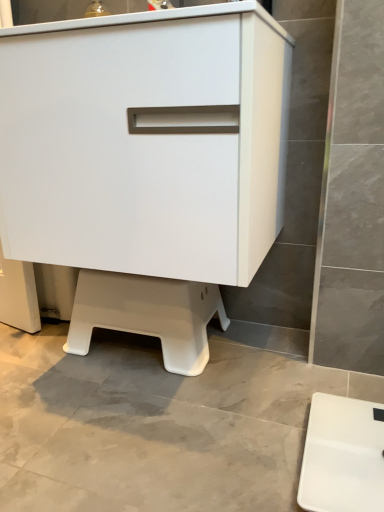
What do you see at coordinates (146, 163) in the screenshot? I see `white matte cabinet at center` at bounding box center [146, 163].

This screenshot has width=384, height=512. Describe the element at coordinates (342, 456) in the screenshot. I see `white plastic scale at lower right` at that location.

Locate an element on the screen. white matte cabinet at center is located at coordinates (146, 163).

Is white plastic step stool at lower center positioned beyond the bounds of white plastic scale at lower right?

white plastic step stool at lower center is positioned outside white plastic scale at lower right.

Which is nearer, (187, 339) or (349, 418)?

The point (349, 418) is in front.

Considering the sizes of objects white plastic step stool at lower center and white plastic scale at lower right in the image provided, who is smaller, white plastic step stool at lower center or white plastic scale at lower right?

white plastic scale at lower right.

Considering the positions of objects white plastic step stool at lower center and white plastic scale at lower right in the image provided, who is more to the right, white plastic step stool at lower center or white plastic scale at lower right?

white plastic scale at lower right.

From a real-world perspective, is white plastic scale at lower right physically above white plastic step stool at lower center?

Incorrect, from a real-world perspective, white plastic scale at lower right is lower than white plastic step stool at lower center.

Which of these two, white plastic scale at lower right or white plastic step stool at lower center, stands shorter?

Standing shorter between the two is white plastic scale at lower right.

Is white plastic scale at lower right wider than white plastic step stool at lower center?

Yes.

Find the location of a particular element. The image size is (384, 512). chest of drawers located on the right of white plastic step stool at lower center is located at coordinates (146, 163).

From the image's perspective, would you say white matte cabinet at center is positioned over white plastic step stool at lower center?

Indeed, from the image's perspective, white matte cabinet at center is shown above white plastic step stool at lower center.

Considering the positions of point (114, 247) and point (86, 345), is point (114, 247) closer or farther from the camera than point (86, 345)?

Point (114, 247) appears to be closer to the viewer than point (86, 345).

Is white matte cabinet at center aimed at white plastic step stool at lower center?

No, white matte cabinet at center is not oriented towards white plastic step stool at lower center.

Can you confirm if white matte cabinet at center is shorter than white plastic scale at lower right?

No, white matte cabinet at center is not shorter than white plastic scale at lower right.

From a real-world perspective, is white matte cabinet at center physically above white plastic scale at lower right?

Correct, in the physical world, white matte cabinet at center is higher than white plastic scale at lower right.

Is white matte cabinet at center far away from white plastic scale at lower right?

No, white matte cabinet at center is in close proximity to white plastic scale at lower right.

In terms of width, does white plastic step stool at lower center look wider or thinner when compared to white matte cabinet at center?

Considering their sizes, white plastic step stool at lower center looks slimmer than white matte cabinet at center.

From the picture: Is the depth of white plastic step stool at lower center less than that of white matte cabinet at center?

No.

Considering the sizes of objects white plastic step stool at lower center and white matte cabinet at center in the image provided, who is bigger, white plastic step stool at lower center or white matte cabinet at center?

white matte cabinet at center.

Does white plastic scale at lower right have a greater width compared to white matte cabinet at center?

In fact, white plastic scale at lower right might be narrower than white matte cabinet at center.

Locate an element on the screen. the chest of drawers above the white plastic scale at lower right (from the image's perspective) is located at coordinates (146, 163).

Which of these two, white plastic scale at lower right or white matte cabinet at center, is smaller?

white plastic scale at lower right.

In the scene shown: From their relative heights in the image, would you say white plastic scale at lower right is taller or shorter than white matte cabinet at center?

Clearly, white plastic scale at lower right is shorter compared to white matte cabinet at center.

Find the location of `furniture in front of the white plastic step stool at lower center`. furniture in front of the white plastic step stool at lower center is located at coordinates tap(342, 456).

Locate an element on the screen. This screenshot has width=384, height=512. furniture below the white plastic step stool at lower center (from the image's perspective) is located at coordinates (342, 456).

Which object lies further to the anchor point white plastic step stool at lower center, white plastic scale at lower right or white matte cabinet at center?

white plastic scale at lower right is further to white plastic step stool at lower center.

Based on their spatial positions, is white matte cabinet at center or white plastic scale at lower right further from white plastic step stool at lower center?

white plastic scale at lower right is positioned further to the anchor white plastic step stool at lower center.

Based on their spatial positions, is white plastic scale at lower right or white plastic step stool at lower center closer to white matte cabinet at center?

white plastic step stool at lower center.

Consider the image. Estimate the real-world distances between objects in this image. Which object is further from white plastic scale at lower right, white plastic step stool at lower center or white matte cabinet at center?

Among the two, white matte cabinet at center is located further to white plastic scale at lower right.

Estimate the real-world distances between objects in this image. Which object is further from white plastic scale at lower right, white matte cabinet at center or white plastic step stool at lower center?

Based on the image, white matte cabinet at center appears to be further to white plastic scale at lower right.

Looking at this image, looking at the image, which one is located further to white matte cabinet at center, white plastic step stool at lower center or white plastic scale at lower right?

The object further to white matte cabinet at center is white plastic scale at lower right.

Locate an element on the screen. The width and height of the screenshot is (384, 512). step stool that lies between white matte cabinet at center and white plastic scale at lower right from top to bottom is located at coordinates (148, 315).